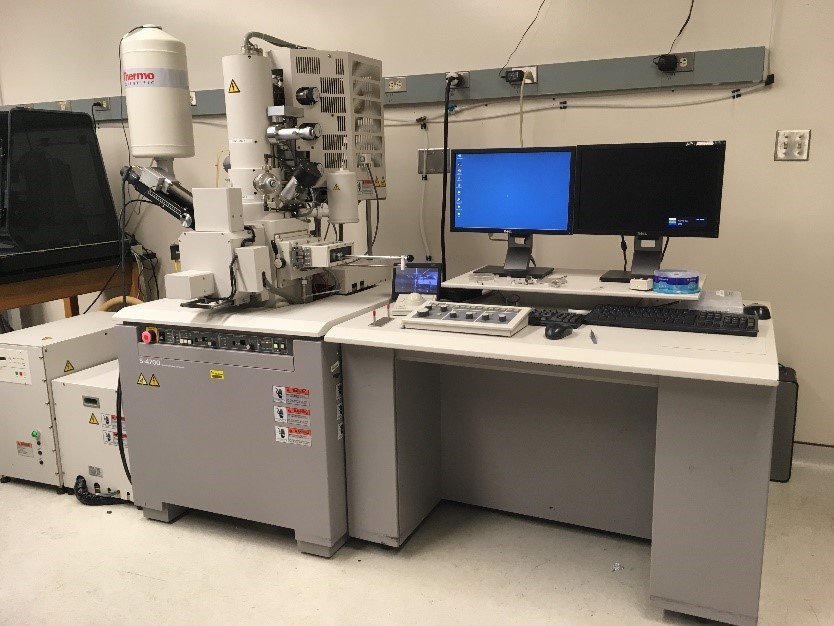
Identify the location of keyboard. Image resolution: width=834 pixels, height=626 pixels. pos(676,319).